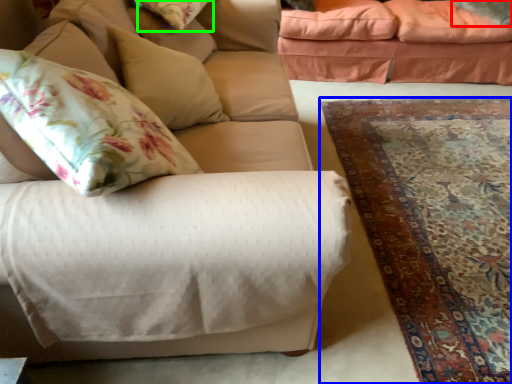
Question: Based on their relative distances, which object is nearer to pillow (highlighted by a red box)? Choose from mat (highlighted by a blue box) and pillow (highlighted by a green box).

Choices:
 (A) mat
 (B) pillow

Answer: (A)